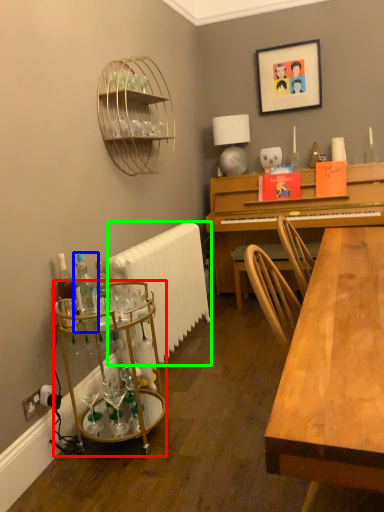
Question: Which is farther away from table (highlighted by a red box)? bottle (highlighted by a blue box) or radiator (highlighted by a green box)?

Choices:
 (A) bottle
 (B) radiator

Answer: (B)